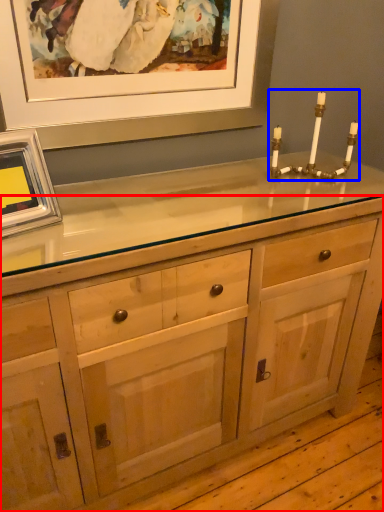
Question: Which point is closer to the camera, chest of drawers (highlighted by a red box) or candle holder (highlighted by a blue box)?

Choices:
 (A) chest of drawers
 (B) candle holder

Answer: (A)